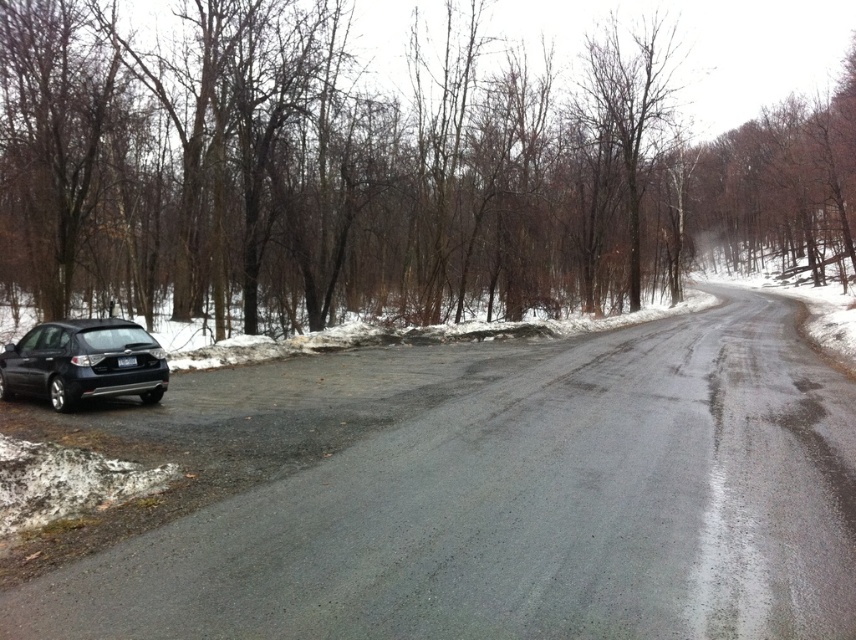
Does black matte car at left appear over satin black hatchback at lower left?

Actually, black matte car at left is below satin black hatchback at lower left.

What do you see at coordinates (528, 512) in the screenshot?
I see `black matte car at left` at bounding box center [528, 512].

Image resolution: width=856 pixels, height=640 pixels. What are the coordinates of `black matte car at left` in the screenshot? It's located at (528, 512).

Where is `black matte car at left`? black matte car at left is located at coordinates (528, 512).

Who is more forward, [421,68] or [304,538]?

Point [304,538] is in front.

From the picture: Does brown matte tree at left appear on the left side of black matte car at left?

In fact, brown matte tree at left is to the right of black matte car at left.

At what (x,y) coordinates should I click in order to perform the action: click on brown matte tree at left. Please return your answer as a coordinate pair (x, y). Image resolution: width=856 pixels, height=640 pixels. Looking at the image, I should click on (382, 168).

I want to click on brown matte tree at left, so click(382, 168).

Can you confirm if brown matte tree at left is positioned below satin black hatchback at lower left?

Incorrect, brown matte tree at left is not positioned below satin black hatchback at lower left.

Who is positioned more to the left, brown matte tree at left or satin black hatchback at lower left?

Positioned to the left is satin black hatchback at lower left.

Between point (827, 260) and point (51, 348), which one is positioned in front?

Point (51, 348) is more forward.

What are the coordinates of `brown matte tree at left` in the screenshot? It's located at (382, 168).